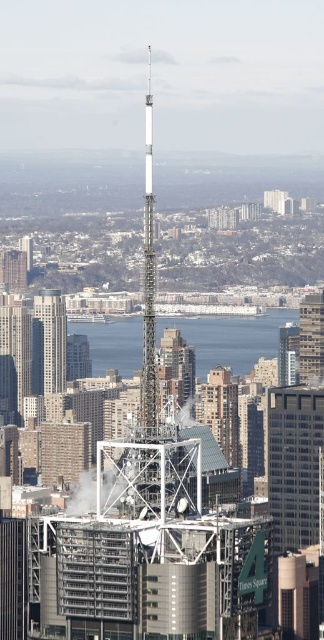
From the picture: Does blue water at center have a greater width compared to matte silver skyscraper at center?

Yes.

Is point (229, 316) in front of point (36, 301)?

Yes, point (229, 316) is closer to viewer.

Does point (257, 339) come closer to viewer compared to point (38, 300)?

Yes, point (257, 339) is closer to viewer.

Locate an element on the screen. blue water at center is located at coordinates (230, 339).

In the scene shown: Measure the distance between metallic silver tower at right and camera.

A distance of 654.41 meters exists between metallic silver tower at right and camera.

Who is shorter, metallic silver tower at right or matte brown building at left?

matte brown building at left

Is point (312, 308) farther from viewer compared to point (25, 273)?

Yes, point (312, 308) is behind point (25, 273).

You are a GUI agent. You are given a task and a screenshot of the screen. Output one action in this format:
    pyautogui.click(x=<x>, y=<y>)
    Task: Click on the metallic silver tower at right
    This screenshot has height=640, width=324.
    Given the screenshot: What is the action you would take?
    pyautogui.click(x=311, y=337)

Does matte silver skyscraper at center appear under matte brown building at left?

Indeed, matte silver skyscraper at center is positioned under matte brown building at left.

Who is more distant from viewer, (46, 298) or (3, 252)?

Point (3, 252)

Identify the location of matte silver skyscraper at center. The width and height of the screenshot is (324, 640). (53, 339).